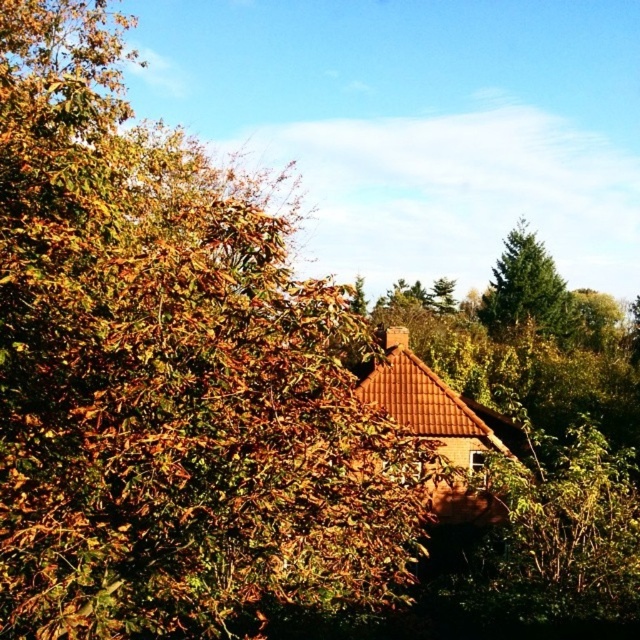
Question: Does brown leafy tree at center appear on the right side of green fir tree at upper right?

Choices:
 (A) yes
 (B) no

Answer: (B)

Question: Among these objects, which one is farthest from the camera?

Choices:
 (A) green fir tree at upper right
 (B) brown leafy tree at center

Answer: (A)

Question: Which point is farther to the camera?

Choices:
 (A) (112, 216)
 (B) (538, 324)

Answer: (B)

Question: Observing the image, what is the correct spatial positioning of brown leafy tree at center in reference to green fir tree at upper right?

Choices:
 (A) above
 (B) below

Answer: (A)

Question: Among these points, which one is farthest from the camera?

Choices:
 (A) (538, 296)
 (B) (108, 209)

Answer: (A)

Question: Is brown leafy tree at center to the left of green fir tree at upper right from the viewer's perspective?

Choices:
 (A) no
 (B) yes

Answer: (B)